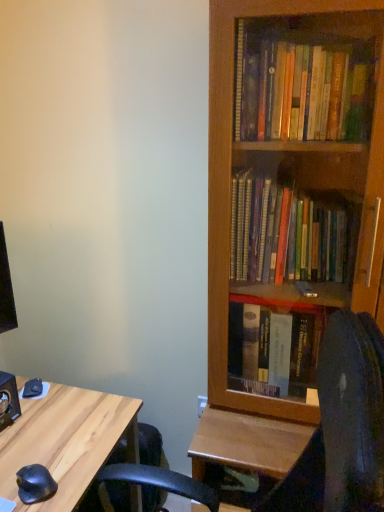
You are a GUI agent. You are given a task and a screenshot of the screen. Output one action in this format:
    pyautogui.click(x=<x>, y=<y>)
    Task: Click on the vacant area located to the right-hand side of black rubber mouse at lower left
    Image resolution: width=384 pixels, height=512 pixels.
    Given the screenshot: What is the action you would take?
    pyautogui.click(x=71, y=484)